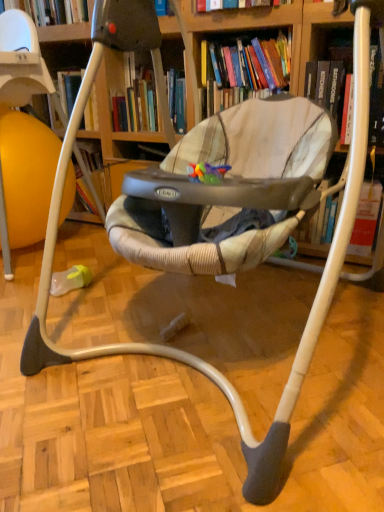
Question: Is hardcover book at upper center, the second book in the right-to-left sequence, aimed at hardcover book at upper right, placed as the first book when sorted from right to left?

Choices:
 (A) yes
 (B) no

Answer: (B)

Question: Is hardcover book at upper center, the first book viewed from the left, located outside hardcover book at upper right, which appears as the 2th book when viewed from the left?

Choices:
 (A) no
 (B) yes

Answer: (B)

Question: Can you confirm if hardcover book at upper center, the first book viewed from the left, is shorter than hardcover book at upper right, which appears as the 2th book when viewed from the left?

Choices:
 (A) no
 (B) yes

Answer: (B)

Question: From a real-world perspective, is hardcover book at upper center, the second book in the right-to-left sequence, located higher than hardcover book at upper right, placed as the first book when sorted from right to left?

Choices:
 (A) no
 (B) yes

Answer: (B)

Question: Does hardcover book at upper center, the second book in the right-to-left sequence, have a smaller size compared to hardcover book at upper right, which appears as the 2th book when viewed from the left?

Choices:
 (A) no
 (B) yes

Answer: (A)

Question: From a real-world perspective, relative to hardcover book at upper center, the first book viewed from the left, is hardcover book at upper right, placed as the first book when sorted from right to left, vertically above or below?

Choices:
 (A) below
 (B) above

Answer: (A)

Question: Is hardcover book at upper right, which appears as the 2th book when viewed from the left, inside the boundaries of hardcover book at upper center, the first book viewed from the left, or outside?

Choices:
 (A) outside
 (B) inside

Answer: (A)

Question: Considering the positions of hardcover book at upper right, placed as the first book when sorted from right to left, and hardcover book at upper center, the second book in the right-to-left sequence, in the image, is hardcover book at upper right, placed as the first book when sorted from right to left, taller or shorter than hardcover book at upper center, the second book in the right-to-left sequence,?

Choices:
 (A) short
 (B) tall

Answer: (B)

Question: From the image's perspective, is hardcover book at upper right, placed as the first book when sorted from right to left, above or below hardcover book at upper center, the second book in the right-to-left sequence?

Choices:
 (A) below
 (B) above

Answer: (A)

Question: Is wooden bookcase at center wider or thinner than hardcover book at upper right, which appears as the 2th book when viewed from the left?

Choices:
 (A) thin
 (B) wide

Answer: (B)

Question: In terms of height, does wooden bookcase at center look taller or shorter compared to hardcover book at upper right, placed as the first book when sorted from right to left?

Choices:
 (A) short
 (B) tall

Answer: (B)

Question: Considering the relative positions of wooden bookcase at center and hardcover book at upper right, placed as the first book when sorted from right to left, in the image provided, is wooden bookcase at center to the left or to the right of hardcover book at upper right, placed as the first book when sorted from right to left,?

Choices:
 (A) left
 (B) right

Answer: (A)

Question: From a real-world perspective, relative to hardcover book at upper right, placed as the first book when sorted from right to left, is wooden bookcase at center vertically above or below?

Choices:
 (A) below
 (B) above

Answer: (A)

Question: From the image's perspective, is hardcover book at upper center, the second book in the right-to-left sequence, above or below wooden bookcase at center?

Choices:
 (A) below
 (B) above

Answer: (B)

Question: Is hardcover book at upper center, the first book viewed from the left, in front of or behind wooden bookcase at center in the image?

Choices:
 (A) front
 (B) behind

Answer: (B)